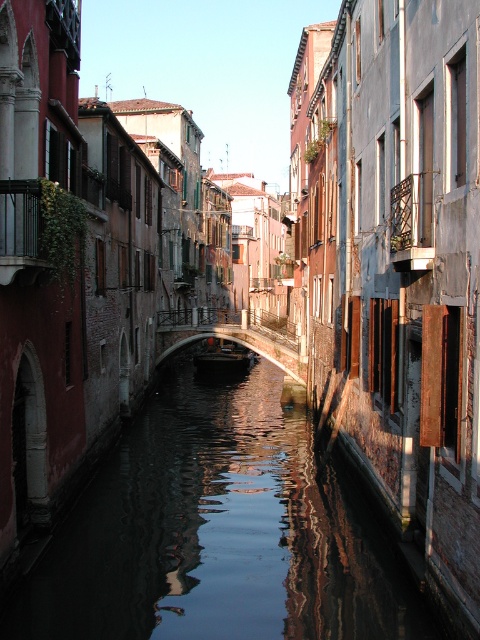
Question: Does reflective dark water at center appear over wooden dark brown boat at center?

Choices:
 (A) no
 (B) yes

Answer: (A)

Question: Is the position of reflective dark water at center more distant than that of wooden dark brown boat at center?

Choices:
 (A) no
 (B) yes

Answer: (A)

Question: In this image, where is reflective dark water at center located relative to wooden dark brown boat at center?

Choices:
 (A) above
 (B) below

Answer: (B)

Question: Which object is closer to the camera taking this photo?

Choices:
 (A) wooden dark brown boat at center
 (B) reflective dark water at center

Answer: (B)

Question: Which point appears farthest from the camera in this image?

Choices:
 (A) (339, 580)
 (B) (203, 355)

Answer: (B)